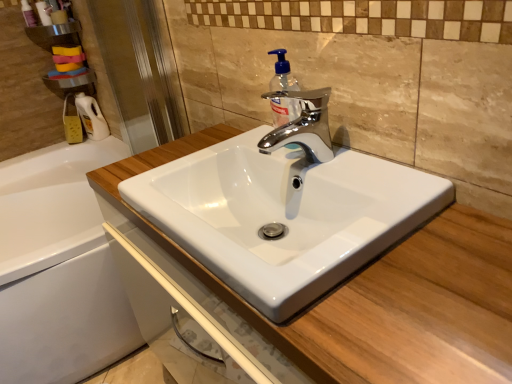
Question: From the image's perspective, is transparent plastic screen door at left below metallic silver shelf at upper left?

Choices:
 (A) no
 (B) yes

Answer: (B)

Question: Considering the relative positions of transparent plastic screen door at left and metallic silver shelf at upper left in the image provided, is transparent plastic screen door at left behind metallic silver shelf at upper left?

Choices:
 (A) yes
 (B) no

Answer: (B)

Question: Is transparent plastic screen door at left looking in the opposite direction of metallic silver shelf at upper left?

Choices:
 (A) no
 (B) yes

Answer: (A)

Question: Would you say transparent plastic screen door at left contains metallic silver shelf at upper left?

Choices:
 (A) yes
 (B) no

Answer: (B)

Question: Does transparent plastic screen door at left have a lesser height compared to metallic silver shelf at upper left?

Choices:
 (A) yes
 (B) no

Answer: (B)

Question: Based on their sizes in the image, would you say white glossy sink at center is bigger or smaller than transparent plastic soap dispenser at center?

Choices:
 (A) small
 (B) big

Answer: (B)

Question: Considering the relative positions of white glossy sink at center and transparent plastic soap dispenser at center in the image provided, is white glossy sink at center to the left or to the right of transparent plastic soap dispenser at center?

Choices:
 (A) left
 (B) right

Answer: (A)

Question: Do you think white glossy sink at center is within transparent plastic soap dispenser at center, or outside of it?

Choices:
 (A) outside
 (B) inside

Answer: (A)

Question: Looking at their shapes, would you say white glossy sink at center is wider or thinner than transparent plastic soap dispenser at center?

Choices:
 (A) thin
 (B) wide

Answer: (B)

Question: Looking at their shapes, would you say metallic silver shelf at upper left is wider or thinner than transparent plastic soap dispenser at center?

Choices:
 (A) thin
 (B) wide

Answer: (B)

Question: From a real-world perspective, relative to transparent plastic soap dispenser at center, is metallic silver shelf at upper left vertically above or below?

Choices:
 (A) below
 (B) above

Answer: (B)

Question: From the image's perspective, is metallic silver shelf at upper left positioned above or below transparent plastic soap dispenser at center?

Choices:
 (A) below
 (B) above

Answer: (B)

Question: Is metallic silver shelf at upper left bigger or smaller than transparent plastic soap dispenser at center?

Choices:
 (A) big
 (B) small

Answer: (A)

Question: Looking at the image, does transparent plastic soap dispenser at center seem bigger or smaller compared to transparent plastic screen door at left?

Choices:
 (A) big
 (B) small

Answer: (B)

Question: Is point (278, 61) closer or farther from the camera than point (115, 49)?

Choices:
 (A) closer
 (B) farther

Answer: (A)